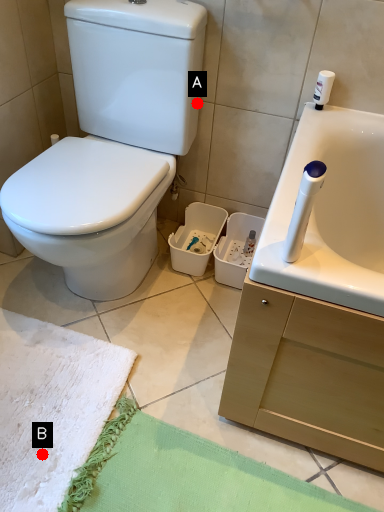
Question: Two points are circled on the image, labeled by A and B beside each circle. Which point is farther from the camera taking this photo?

Choices:
 (A) A is further
 (B) B is further

Answer: (A)